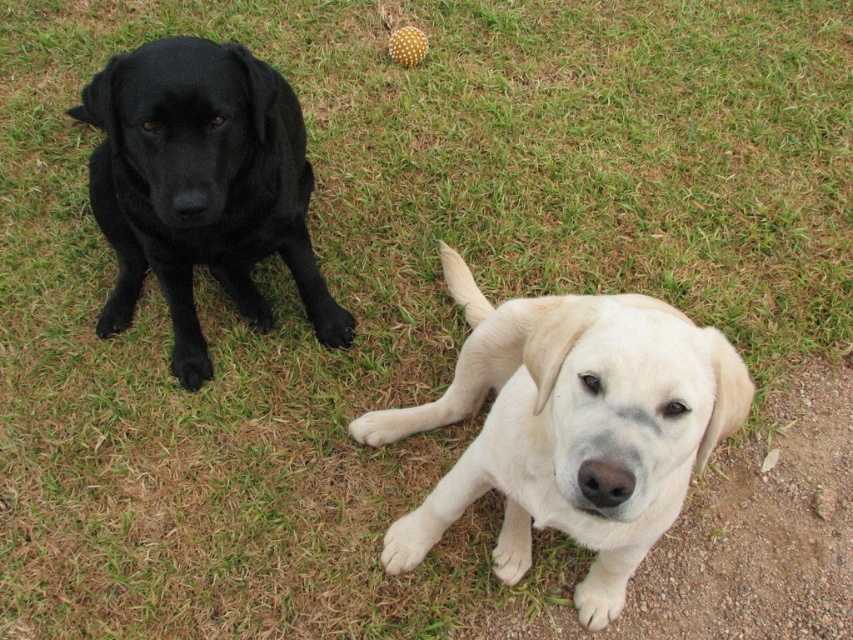
Is point (567, 333) positioned after point (308, 243)?

No.

Which is below, light beige fur at center or matte black dog at left?

light beige fur at center is below.

Locate an element on the screen. light beige fur at center is located at coordinates [572, 428].